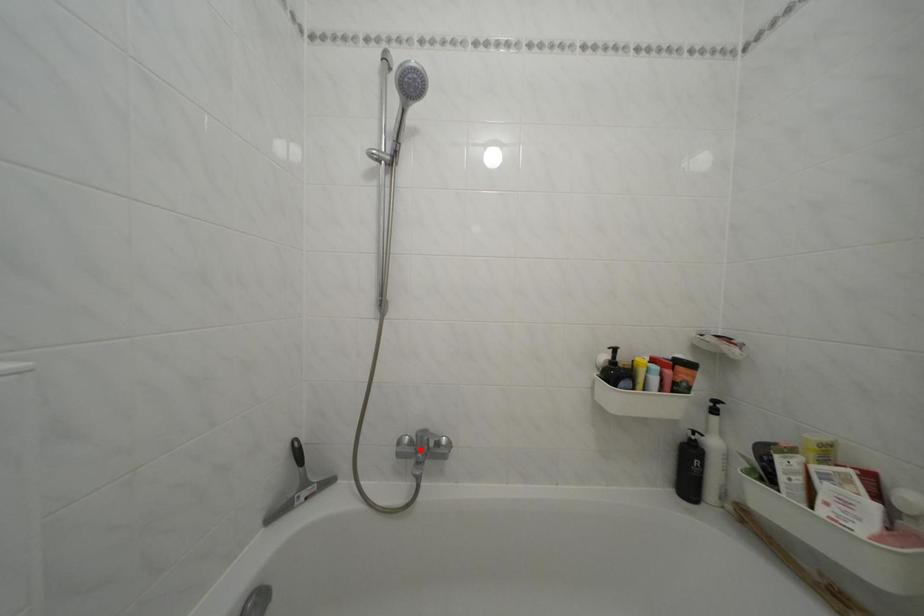
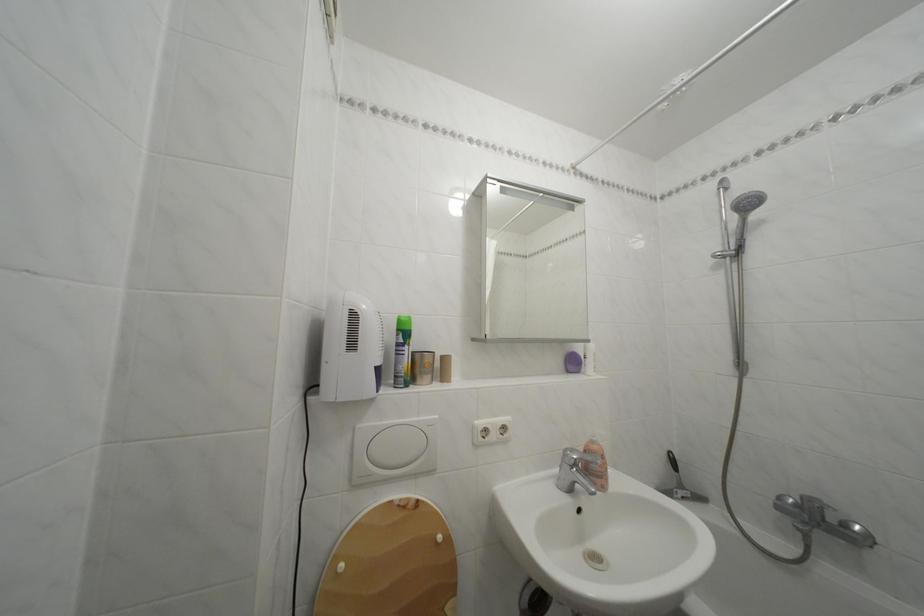
Find the pixel in the second image that matches the highlighted location in the first image.

(806, 512)